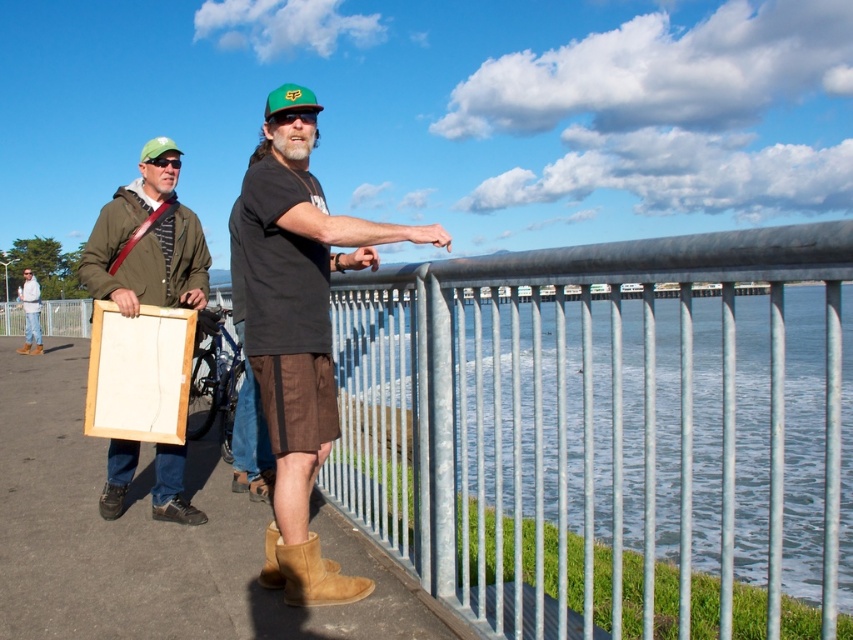
Between wooden frame at left and brown suede boot at lower center, which one is positioned higher?

Positioned higher is wooden frame at left.

Consider the image. Who is more distant from viewer, (x=173, y=184) or (x=277, y=570)?

Positioned behind is point (x=173, y=184).

Between point (126, 195) and point (273, 566), which one is positioned behind?

Positioned behind is point (126, 195).

Locate an element on the screen. The width and height of the screenshot is (853, 640). wooden frame at left is located at coordinates click(x=148, y=241).

Is brown suede boots at center closer to camera compared to tan suede boot at lower center?

Yes.

Is brown suede boots at center wider than tan suede boot at lower center?

Correct, the width of brown suede boots at center exceeds that of tan suede boot at lower center.

Does point (303, 202) come farther from viewer compared to point (341, 582)?

No.

Find the location of `brown suede boots at center`. brown suede boots at center is located at coordinates (299, 323).

Locate an element on the screen. The width and height of the screenshot is (853, 640). clear blue water at center is located at coordinates (596, 442).

Measure the distance between point (740,364) and camera.

76.80 feet

What do you see at coordinates (596, 442) in the screenshot?
I see `clear blue water at center` at bounding box center [596, 442].

Find the location of a particular element. clear blue water at center is located at coordinates (596, 442).